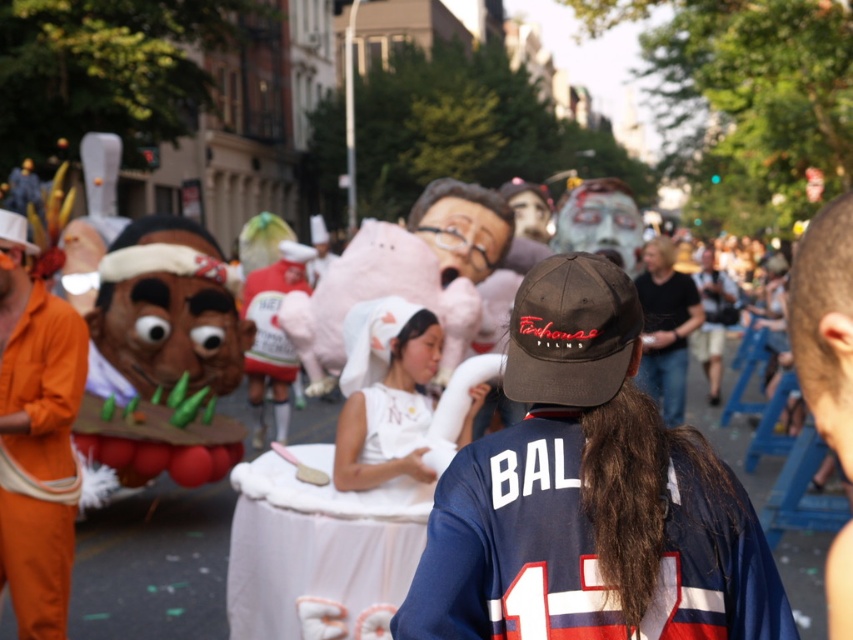
You are a photographer standing at the center of the street. You want to take a photo of the matte pink plush at center. Where should you aim your camera to capture it?

The matte pink plush at center is located at coordinates point (463,227), so you should aim your camera at that position to capture it.

You are standing at the parade and see two points marked on the ground in front of you. The first point is at coordinates point (x=556, y=516) and the second point is at point (x=9, y=557). Which point is closer to you?

Point (x=556, y=516) is closer to the viewer than point (x=9, y=557).